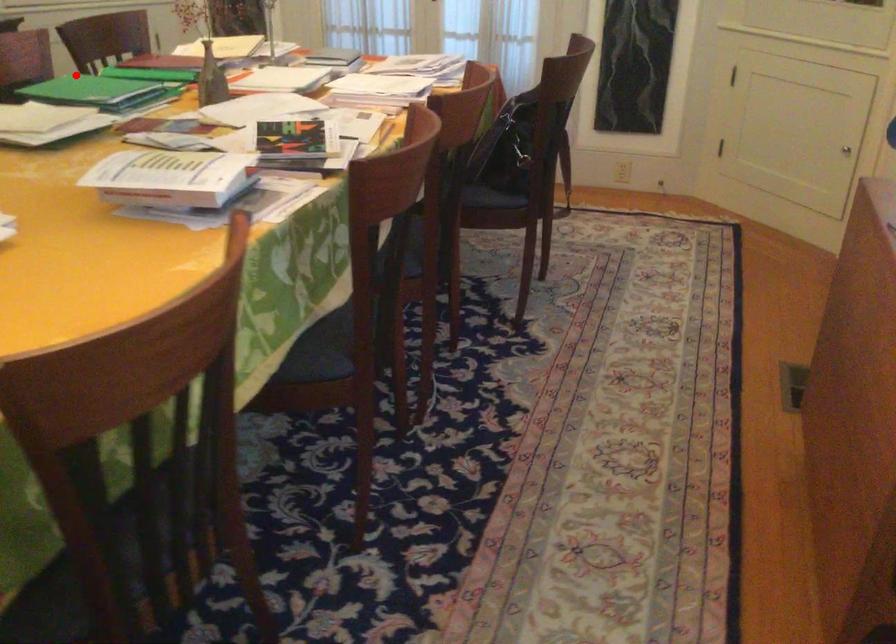
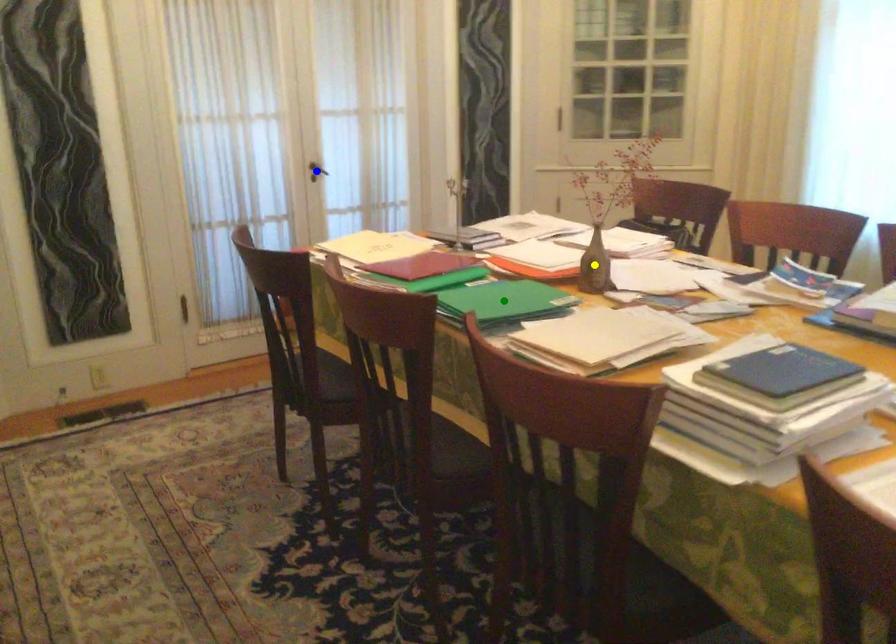
Question: I am providing you with two images of the same scene from different viewpoints. A red point is marked on the first image. You are given multiple points on the second image. Can you choose the point in image 2 that corresponds to the point in image 1?

Choices:
 (A) green point
 (B) yellow point
 (C) blue point

Answer: (A)